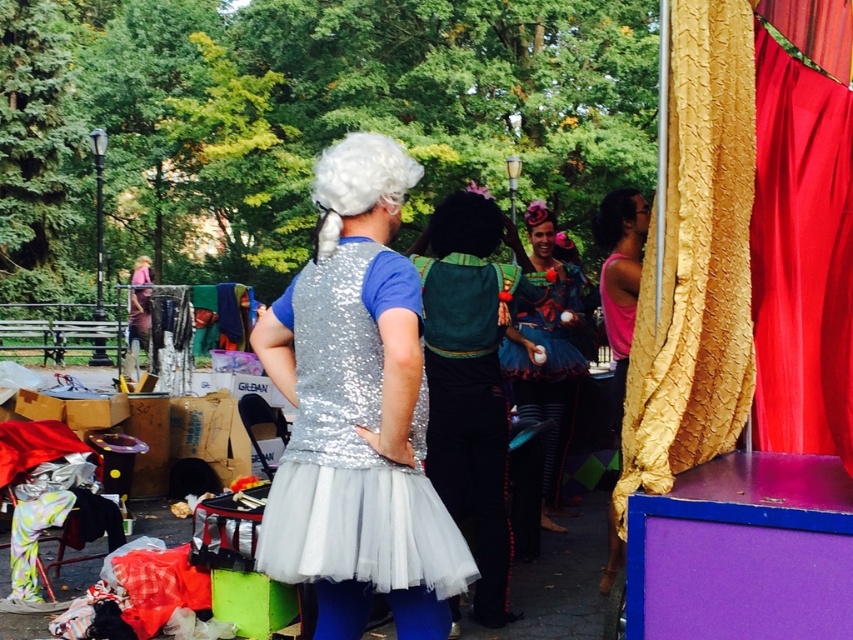
Question: Is shiny silver dress at center above black sequined wig at upper right?

Choices:
 (A) yes
 (B) no

Answer: (B)

Question: Estimate the real-world distances between objects in this image. Which object is farther from the black sequined wig at upper right?

Choices:
 (A) red velvet curtain at upper right
 (B) shiny silver dress at center
 (C) shiny blue tulle skirt at center
 (D) white curly wig at upper center

Answer: (D)

Question: Does shiny silver dress at center come in front of shiny blue tulle skirt at center?

Choices:
 (A) yes
 (B) no

Answer: (A)

Question: Which object is positioned farthest from the green sequined vest at center?

Choices:
 (A) shiny silver dress at center
 (B) black sequined wig at upper right

Answer: (A)

Question: Does shiny silver dress at center have a lesser width compared to green sequined vest at center?

Choices:
 (A) no
 (B) yes

Answer: (B)

Question: Which object is closer to the camera taking this photo?

Choices:
 (A) shiny blue tulle skirt at center
 (B) white curly wig at upper center

Answer: (B)